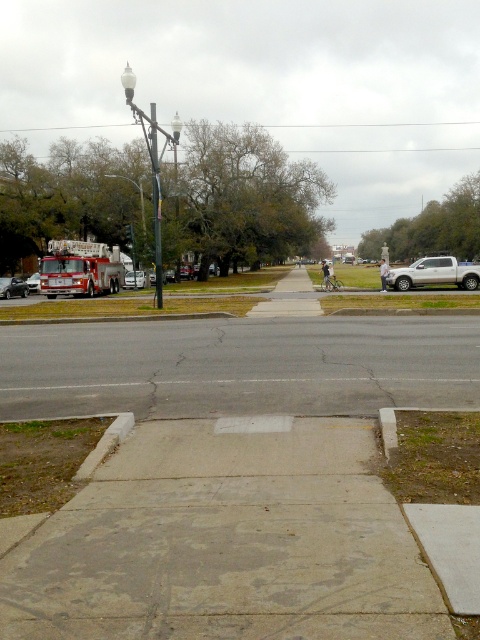
Question: Among these objects, which one is nearest to the camera?

Choices:
 (A) white glass lamp post at upper center
 (B) silver metallic truck at right
 (C) matte red fire truck at left

Answer: (A)

Question: Does matte red fire truck at left have a smaller size compared to metallic silver car at center?

Choices:
 (A) no
 (B) yes

Answer: (A)

Question: Among these points, which one is nearest to the camera?

Choices:
 (A) [x=143, y=209]
 (B) [x=37, y=276]

Answer: (B)

Question: Can you confirm if white glass lamp post at upper center is positioned to the right of metallic silver car at center?

Choices:
 (A) no
 (B) yes

Answer: (A)

Question: Which object is farther from the camera taking this photo?

Choices:
 (A) gray concrete sidewalk at center
 (B) white glass lamp post at upper center
 (C) metallic silver car at center
 (D) silver metallic truck at right

Answer: (C)

Question: Does silver metallic truck at right appear on the right side of matte red fire truck at left?

Choices:
 (A) no
 (B) yes

Answer: (B)